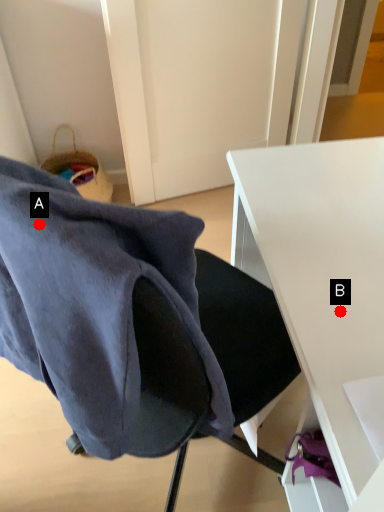
Question: Two points are circled on the image, labeled by A and B beside each circle. Which point is farther from the camera taking this photo?

Choices:
 (A) A is further
 (B) B is further

Answer: (B)